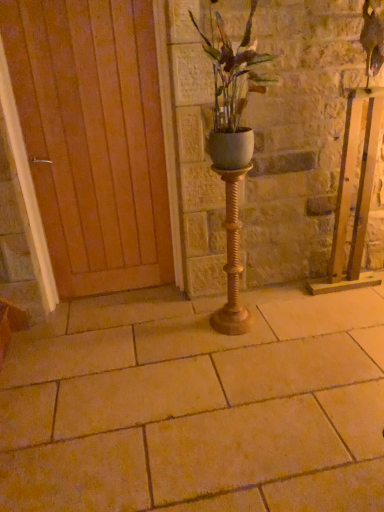
Find the location of `blank area to the left of gold textured candle holder at center`. blank area to the left of gold textured candle holder at center is located at coordinates (193, 328).